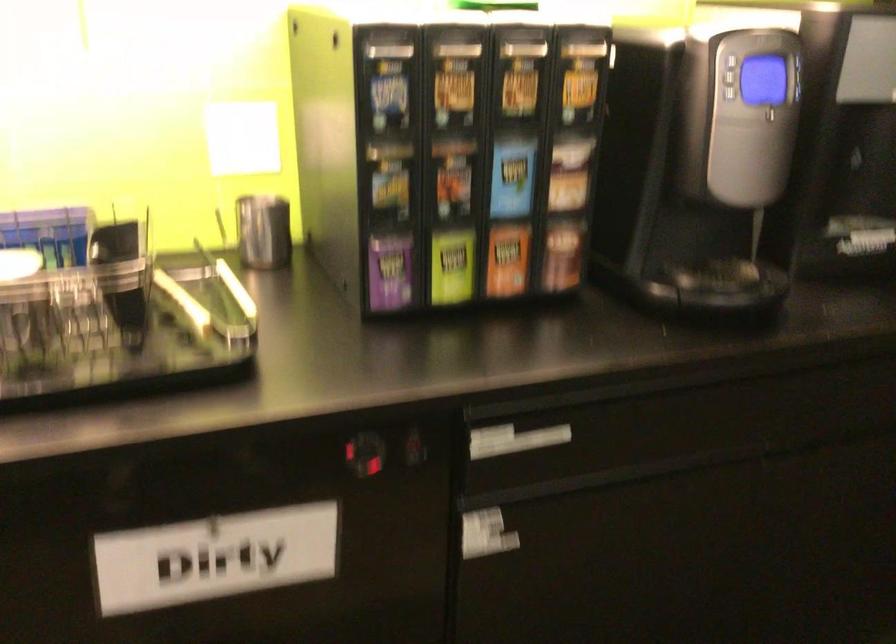
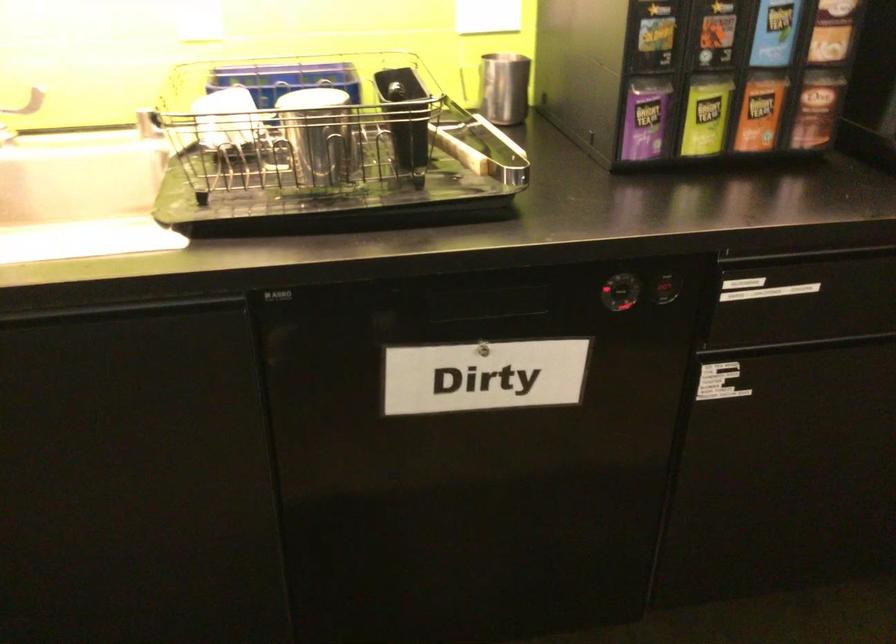
In the second image, find the point that corresponds to pixel 259 228 in the first image.

(504, 88)